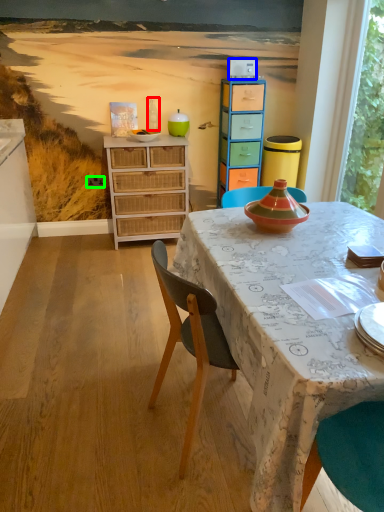
Question: Which is nearer to the bottle (highlighted by a red box)? corded phone (highlighted by a blue box) or power outlet (highlighted by a green box).

Choices:
 (A) corded phone
 (B) power outlet

Answer: (B)